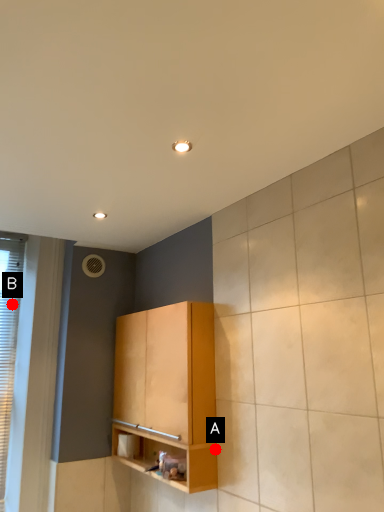
Question: Two points are circled on the image, labeled by A and B beside each circle. Which point is closer to the camera taking this photo?

Choices:
 (A) A is closer
 (B) B is closer

Answer: (A)